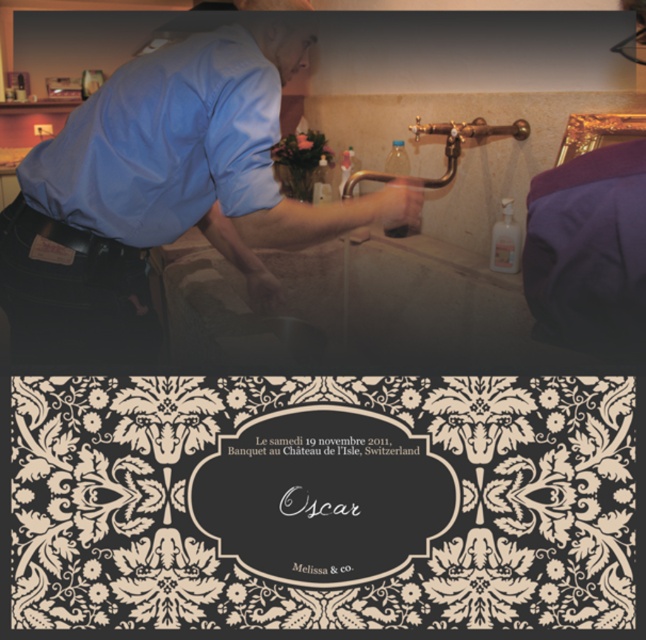
Is blue smooth shirt at center positioned behind matte blue shirt at upper left?

That is True.

Who is positioned more to the left, blue smooth shirt at center or matte blue shirt at upper left?

From the viewer's perspective, matte blue shirt at upper left appears more on the left side.

Is point (43, 256) positioned after point (50, 182)?

Yes, it is behind point (50, 182).

Where is `blue smooth shirt at center`? blue smooth shirt at center is located at coordinates (162, 189).